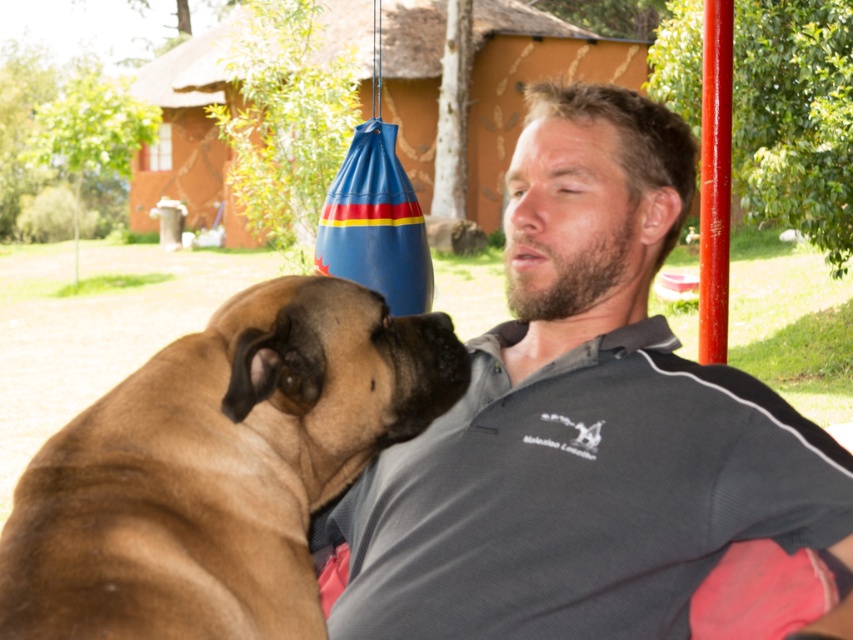
Is point (641, 445) in front of point (49, 579)?

No, (641, 445) is behind (49, 579).

Image resolution: width=853 pixels, height=640 pixels. What do you see at coordinates (583, 420) in the screenshot?
I see `gray cotton polo shirt at center` at bounding box center [583, 420].

Find the location of a particular element. gray cotton polo shirt at center is located at coordinates (583, 420).

Find the location of a particular element. gray cotton polo shirt at center is located at coordinates (583, 420).